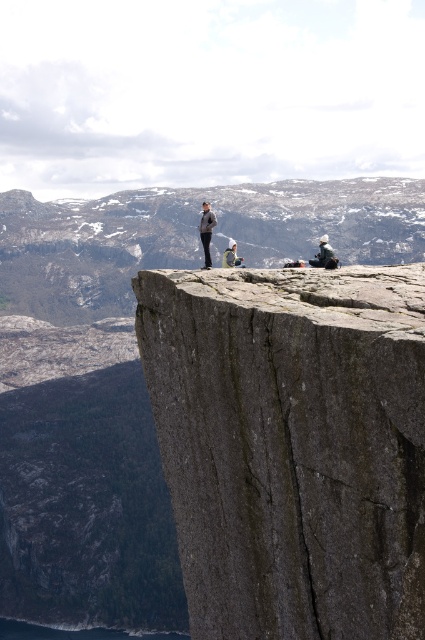
Question: Which point is farther to the camera?

Choices:
 (A) (183, 413)
 (B) (209, 216)
 (C) (309, 260)

Answer: (C)

Question: Which object is closer to the camera taking this photo?

Choices:
 (A) light gray fabric jacket at center
 (B) gray rough rock face at center
 (C) gray rough rock at center

Answer: (B)

Question: Which of the following is the closest to the observer?

Choices:
 (A) (320, 240)
 (B) (337, 321)
 (C) (207, 216)
 (D) (235, 241)

Answer: (B)

Question: Is white fabric jacket at upper center positioned in front of light gray fabric jacket at center?

Choices:
 (A) yes
 (B) no

Answer: (A)

Question: Is gray fabric jacket at center to the right of light gray fabric jacket at center from the viewer's perspective?

Choices:
 (A) yes
 (B) no

Answer: (B)

Question: Can you confirm if gray rough rock face at center is positioned to the right of gray fabric jacket at center?

Choices:
 (A) yes
 (B) no

Answer: (A)